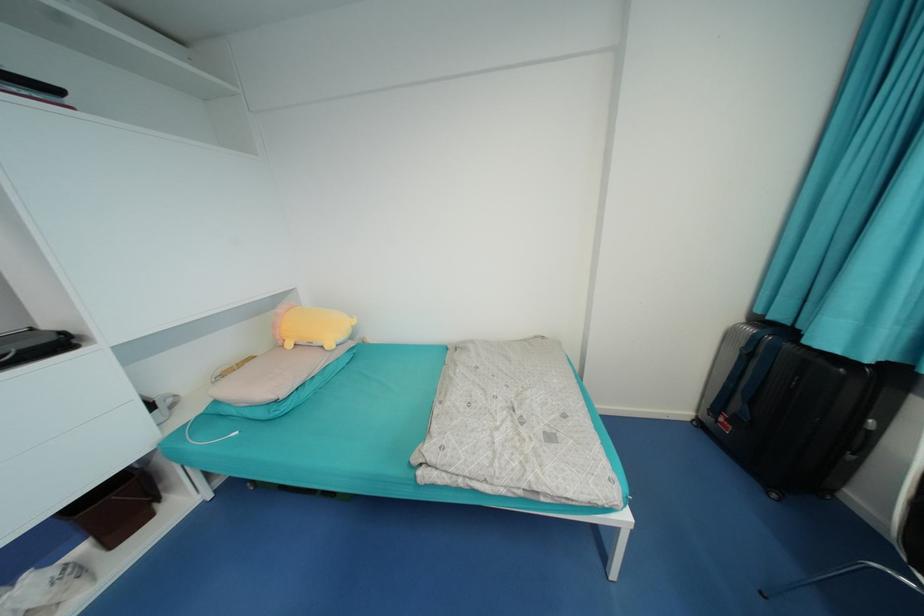
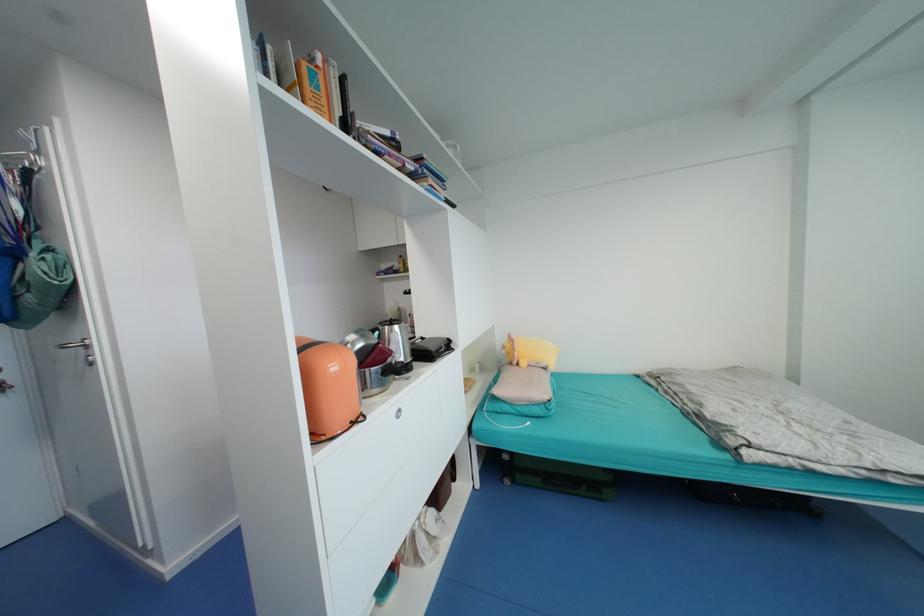
The point at (294, 346) is marked in the first image. Where is the corresponding point in the second image?

(529, 365)